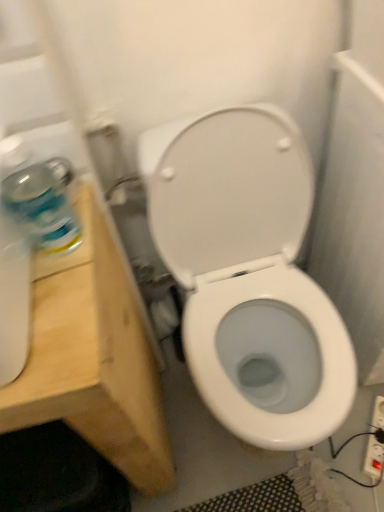
Find the location of `vacant area that lies in front of clear plastic bottle at left`. vacant area that lies in front of clear plastic bottle at left is located at coordinates (57, 324).